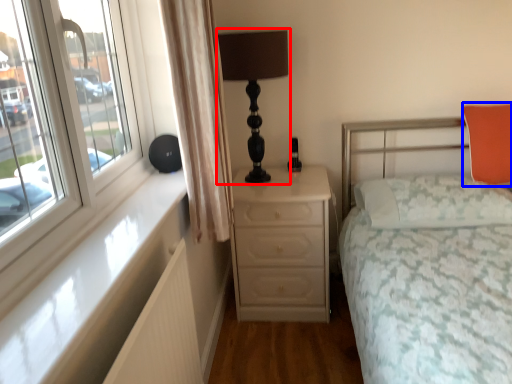
Question: Which object is further to the camera taking this photo, table lamp (highlighted by a red box) or pillow (highlighted by a blue box)?

Choices:
 (A) table lamp
 (B) pillow

Answer: (B)